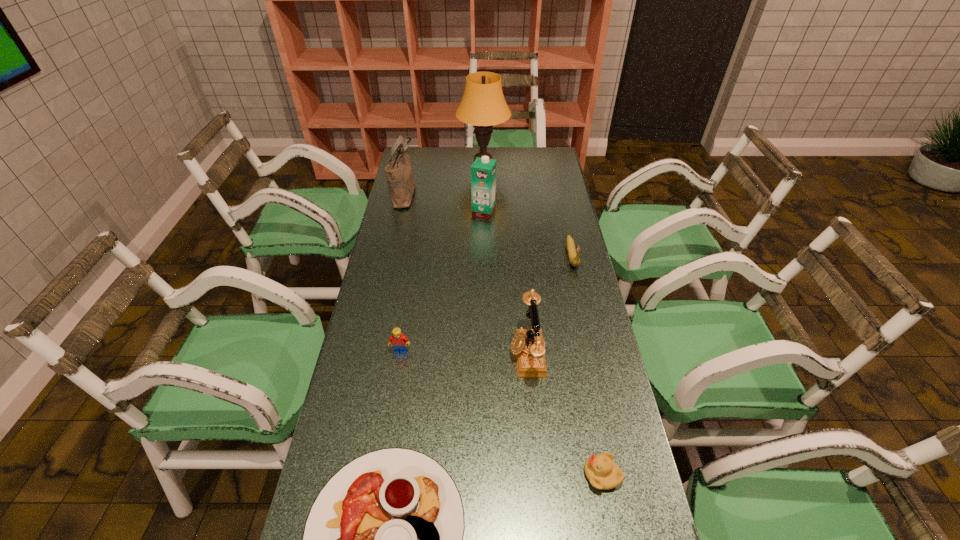
This screenshot has height=540, width=960. I want to click on lampshade, so click(483, 105).

Locate an element on the screen. This screenshot has width=960, height=540. the tallest object is located at coordinates (483, 105).

I want to click on shoulder bag, so click(399, 175).

Where is `carton`? carton is located at coordinates (483, 171).

This screenshot has height=540, width=960. Find the location of `the fifth shortest object`. the fifth shortest object is located at coordinates (527, 344).

Locate an element on the screen. The image size is (960, 540). banana is located at coordinates (574, 260).

Locate an element on the screen. Lego is located at coordinates (399, 341).

I want to click on duckling, so click(602, 472).

This screenshot has height=540, width=960. What are the coordinates of `vacant space located on the front of the lampshade` in the screenshot? It's located at (484, 225).

Image resolution: width=960 pixels, height=540 pixels. I want to click on vacant area located on the front-facing side of the shoulder bag, so click(x=431, y=194).